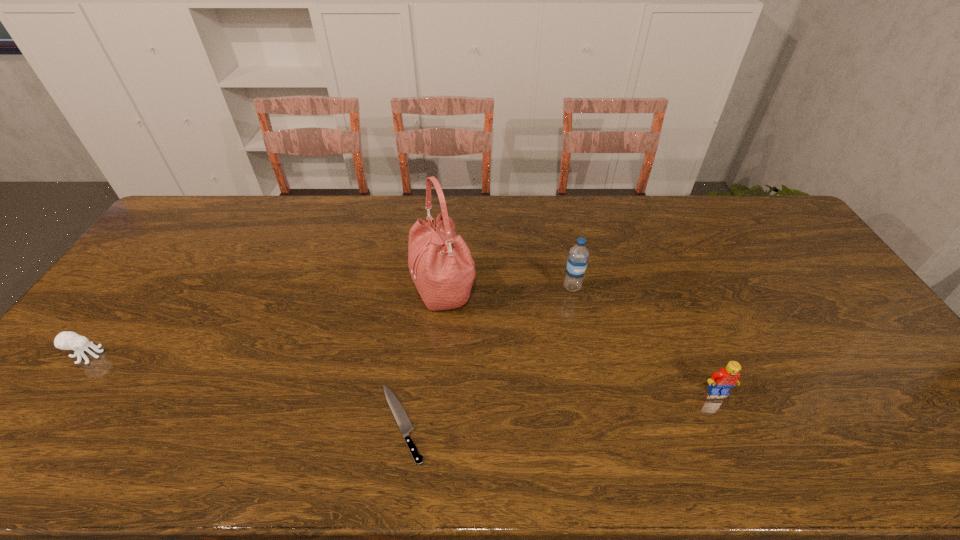
You are a GUI agent. You are given a task and a screenshot of the screen. Output one action in this format:
    pyautogui.click(x=<x>, y=<y>)
    Task: Click on the object that stands as the closest to the second shortest object
    
    Given the screenshot: What is the action you would take?
    pyautogui.click(x=402, y=419)

At what (x,y) coordinates should I click in order to perform the action: click on vacant region that satisfies the following two spatial constraints: 1. on the label of the second tallest object; 2. on the front-facing side of the second shortest object. Please return your answer as a coordinate pair (x, y). Image resolution: width=960 pixels, height=540 pixels. Looking at the image, I should click on (587, 355).

The image size is (960, 540). I want to click on vacant space that satisfies the following two spatial constraints: 1. on the front-facing side of the shortest object; 2. on the right side of the fourth tallest object, so click(36, 423).

Where is `vacant space that satisfies the following two spatial constraints: 1. on the label of the second tallest object; 2. on the front-facing side of the octopus`? vacant space that satisfies the following two spatial constraints: 1. on the label of the second tallest object; 2. on the front-facing side of the octopus is located at coordinates tap(587, 355).

You are a GUI agent. You are given a task and a screenshot of the screen. Output one action in this format:
    pyautogui.click(x=<x>, y=<y>)
    Task: Click on the blank area in the image that satisfies the following two spatial constraints: 1. on the label of the fourth shortest object; 2. on the front-facing side of the second shortest object
    
    Given the screenshot: What is the action you would take?
    pyautogui.click(x=587, y=355)